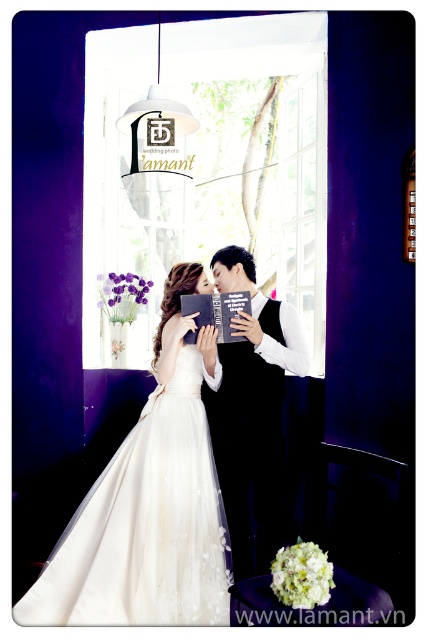
You are a photographer setting up for a wedding shoot. You need to position a spotlight to the right of both the white satin dress at center and the black satin suit at center. Is this possible given their current positions?

The white satin dress at center is to the left of the black satin suit at center. Therefore, placing a spotlight to the right of both the white satin dress at center and the black satin suit at center is possible since the spotlight can be positioned to the right side of the black satin suit at center, which is already to the right of the white satin dress at center.

You are a photographer setting up for a wedding photo shoot. You need to ensure there is enough space between the white satin dress at center and the black satin suit at center for the couple to hold a book comfortably. What is the minimum distance required between them to accommodate the book?

The white satin dress at center and black satin suit at center are 12.51 inches apart from each other, so the minimum distance required to accommodate the book is 12.51 inches.